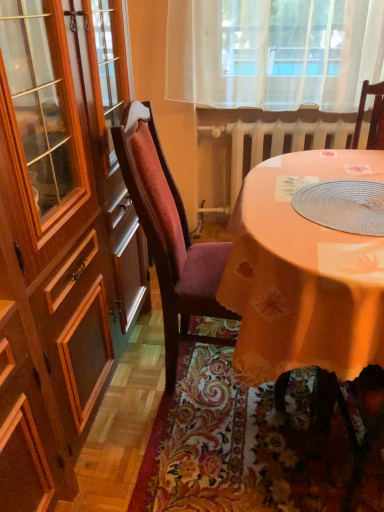
You are a GUI agent. You are given a task and a screenshot of the screen. Output one action in this format:
    pyautogui.click(x=<x>, y=<y>)
    Task: Click on the vacant space underneath clear plastic placemat at center (from a real-world perspective)
    
    Given the screenshot: What is the action you would take?
    pyautogui.click(x=344, y=205)